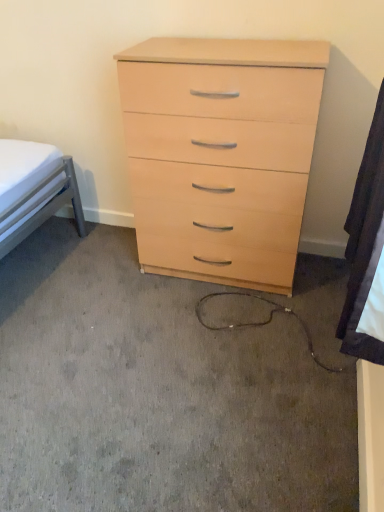
Measure the distance between light wood/finish chest of drawers at center and camera.

light wood/finish chest of drawers at center and camera are 1.45 meters apart.

Identify the location of light wood/finish chest of drawers at center. This screenshot has height=512, width=384. (222, 151).

What do you see at coordinates (222, 151) in the screenshot? Image resolution: width=384 pixels, height=512 pixels. I see `light wood/finish chest of drawers at center` at bounding box center [222, 151].

Image resolution: width=384 pixels, height=512 pixels. Describe the element at coordinates (365, 242) in the screenshot. I see `white fabric at lower right` at that location.

Image resolution: width=384 pixels, height=512 pixels. In order to click on white fabric at lower right in this screenshot , I will do `click(365, 242)`.

Find the location of a particular element. The image size is (384, 512). light wood/finish chest of drawers at center is located at coordinates (222, 151).

Considering the relative positions of white fabric at lower right and light wood/finish chest of drawers at center in the image provided, is white fabric at lower right to the left of light wood/finish chest of drawers at center from the viewer's perspective?

No.

Who is more distant, white fabric at lower right or light wood/finish chest of drawers at center?

light wood/finish chest of drawers at center is behind.

Which is closer, (358, 176) or (152, 66)?

Point (358, 176)

From the image's perspective, between white fabric at lower right and light wood/finish chest of drawers at center, who is located below?

From the image's view, white fabric at lower right is below.

From a real-world perspective, is white fabric at lower right positioned under light wood/finish chest of drawers at center based on gravity?

No, from a real-world perspective, white fabric at lower right is not beneath light wood/finish chest of drawers at center.

Considering the sizes of objects white fabric at lower right and light wood/finish chest of drawers at center in the image provided, who is thinner, white fabric at lower right or light wood/finish chest of drawers at center?

white fabric at lower right.

Does white fabric at lower right have a greater height compared to light wood/finish chest of drawers at center?

No, white fabric at lower right is not taller than light wood/finish chest of drawers at center.

Can you confirm if white fabric at lower right is smaller than light wood/finish chest of drawers at center?

Yes.

Would you say white fabric at lower right is inside or outside light wood/finish chest of drawers at center?

white fabric at lower right cannot be found inside light wood/finish chest of drawers at center.

Is there a large distance between white fabric at lower right and light wood/finish chest of drawers at center?

No, there isn't a large distance between white fabric at lower right and light wood/finish chest of drawers at center.

Could you tell me if white fabric at lower right is turned towards light wood/finish chest of drawers at center?

No, white fabric at lower right is not facing towards light wood/finish chest of drawers at center.

Can you tell me how much white fabric at lower right and light wood/finish chest of drawers at center differ in facing direction?

89.5 degrees separate the facing orientations of white fabric at lower right and light wood/finish chest of drawers at center.

This screenshot has height=512, width=384. I want to click on sheet that is on the right side of light wood/finish chest of drawers at center, so click(365, 242).

Between light wood/finish chest of drawers at center and white fabric at lower right, which one appears on the left side from the viewer's perspective?

From the viewer's perspective, light wood/finish chest of drawers at center appears more on the left side.

Which is in front, light wood/finish chest of drawers at center or white fabric at lower right?

white fabric at lower right is in front.

Which is closer, (165, 234) or (357, 217)?

Positioned in front is point (357, 217).

From the image's perspective, who appears lower, light wood/finish chest of drawers at center or white fabric at lower right?

white fabric at lower right is shown below in the image.

From a real-world perspective, which object stands above the other?

white fabric at lower right is physically above.

Considering the sizes of objects light wood/finish chest of drawers at center and white fabric at lower right in the image provided, who is thinner, light wood/finish chest of drawers at center or white fabric at lower right?

white fabric at lower right is thinner.

Who is shorter, light wood/finish chest of drawers at center or white fabric at lower right?

With less height is white fabric at lower right.

Consider the image. Considering the relative sizes of light wood/finish chest of drawers at center and white fabric at lower right in the image provided, is light wood/finish chest of drawers at center bigger than white fabric at lower right?

Yes, light wood/finish chest of drawers at center is bigger than white fabric at lower right.

From the picture: Is light wood/finish chest of drawers at center inside the boundaries of white fabric at lower right, or outside?

light wood/finish chest of drawers at center lies outside white fabric at lower right.

Would you say light wood/finish chest of drawers at center is a long distance from white fabric at lower right?

No, light wood/finish chest of drawers at center is in close proximity to white fabric at lower right.

Does light wood/finish chest of drawers at center turn towards white fabric at lower right?

Yes.

Measure the distance from light wood/finish chest of drawers at center to white fabric at lower right.

24.33 inches.

Locate an element on the screen. The image size is (384, 512). chest of drawers behind the white fabric at lower right is located at coordinates (222, 151).

This screenshot has height=512, width=384. What are the coordinates of `chest of drawers behind the white fabric at lower right` in the screenshot? It's located at (222, 151).

Image resolution: width=384 pixels, height=512 pixels. There is a light wood/finish chest of drawers at center. Identify the location of sheet above it (from a real-world perspective). (365, 242).